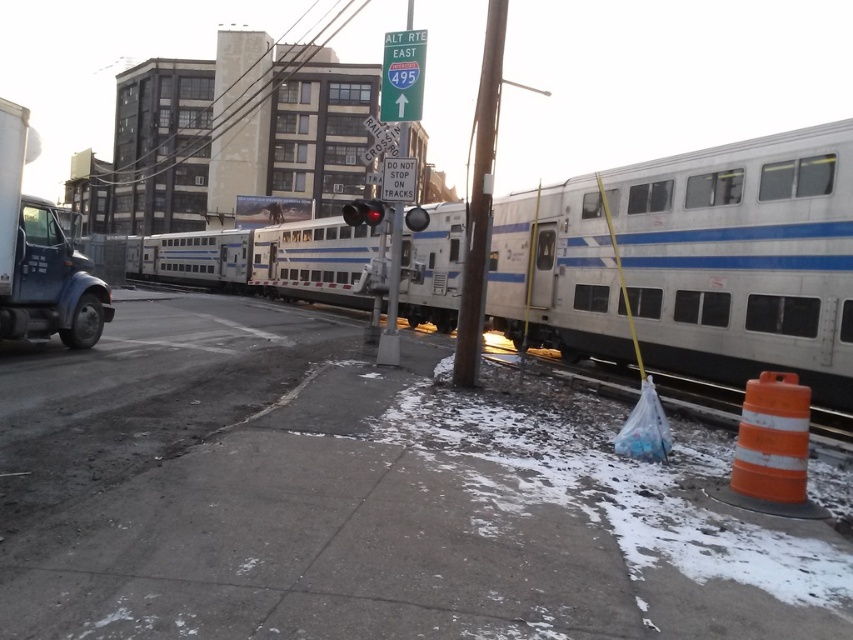
You are a delivery driver approaching the railroad intersection. You see the orange reflective cone at lower right. Based on its position, can you estimate where it is located relative to the railroad tracks?

The orange reflective cone at lower right is located at point (772, 449) in the image, which places it near the lower right corner, likely on the road but not directly on the railroad tracks.

You are standing at the railroad crossing and want to know how far the point marked at coordinates point [798,513] is from you. Can you determine the distance?

The point marked at coordinates point [798,513] is 3.58 meters away from you.

You are driving a car that is 15 feet long and need to stop at the traffic light. There is an orange reflective cone at lower right and a smooth wooden pole at center. Can your car fit between them without crossing the tracks?

The distance between the orange reflective cone at lower right and the smooth wooden pole at center is 12.84 feet. Since your car is 15 feet long, it cannot fit between them without crossing the tracks.